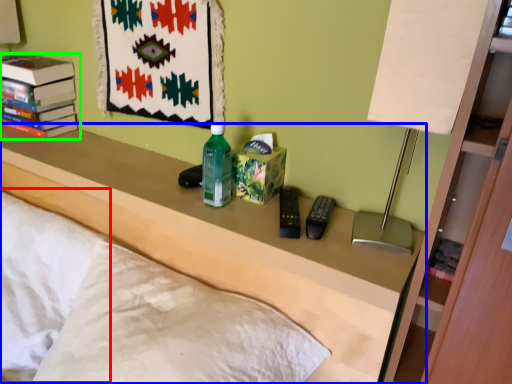
Question: Based on their relative distances, which object is farther from pillow (highlighted by a red box)? Choose from furniture (highlighted by a blue box) and book (highlighted by a green box).

Choices:
 (A) furniture
 (B) book

Answer: (B)